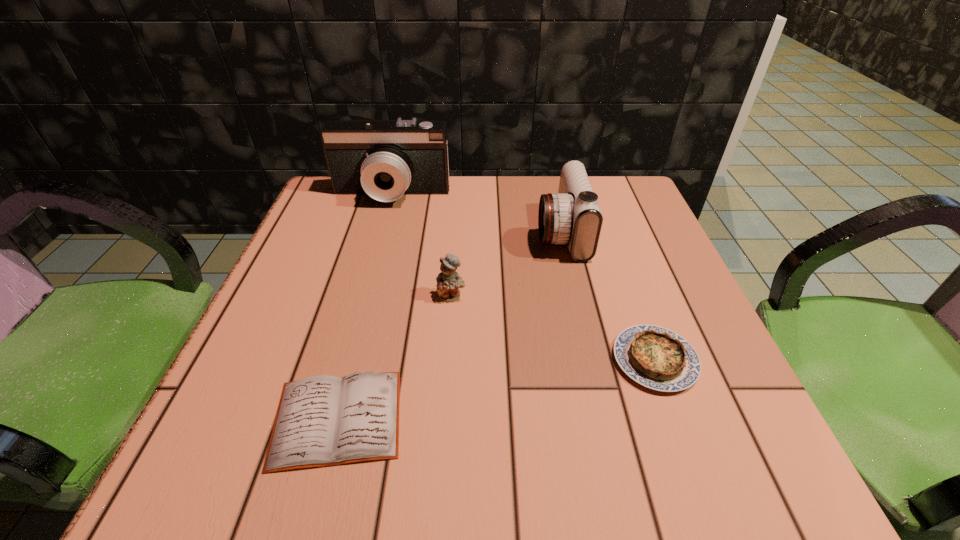
I want to click on object that is at the far left corner, so [x=385, y=159].

You are a GUI agent. You are given a task and a screenshot of the screen. Output one action in this format:
    pyautogui.click(x=<x>, y=<y>)
    Task: Click on the object present at the near left corner
    The width and height of the screenshot is (960, 540).
    Given the screenshot: What is the action you would take?
    pyautogui.click(x=321, y=421)

At what (x,y) coordinates should I click in order to perform the action: click on object that is at the far right corner. Please return your answer as a coordinate pair (x, y). The height and width of the screenshot is (540, 960). Looking at the image, I should click on (572, 216).

At what (x,y) coordinates should I click in order to perform the action: click on free space at the far edge of the desktop. Please return your answer as a coordinate pair (x, y). The width and height of the screenshot is (960, 540). Looking at the image, I should click on (506, 197).

The width and height of the screenshot is (960, 540). What are the coordinates of `vacant space at the near edge` in the screenshot? It's located at (549, 481).

Find the location of a particular element. The height and width of the screenshot is (540, 960). vacant space at the left edge of the desktop is located at coordinates (371, 239).

Locate an element on the screen. vacant space at the right edge of the desktop is located at coordinates (663, 285).

Where is `vacant region at the far left corner`? This screenshot has height=540, width=960. vacant region at the far left corner is located at coordinates (312, 210).

Locate an element on the screen. The width and height of the screenshot is (960, 540). free region at the near left corner of the desktop is located at coordinates (197, 453).

Find the location of a particular element. vacant space at the far right corner of the desktop is located at coordinates (634, 204).